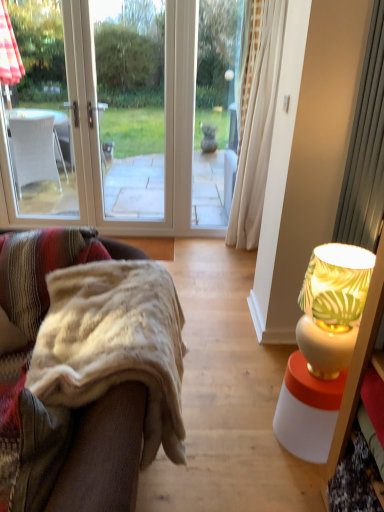
Question: Relative to fuzzy beige blanket at left, is white ceramic lamp at right in front or behind?

Choices:
 (A) front
 (B) behind

Answer: (B)

Question: In the image, is white ceramic lamp at right on the left side or the right side of fuzzy beige blanket at left?

Choices:
 (A) right
 (B) left

Answer: (A)

Question: Is white ceramic lamp at right inside the boundaries of fuzzy beige blanket at left, or outside?

Choices:
 (A) outside
 (B) inside

Answer: (A)

Question: From a real-world perspective, is fuzzy beige blanket at left above or below white ceramic lamp at right?

Choices:
 (A) below
 (B) above

Answer: (A)

Question: Relative to white ceramic lamp at right, is fuzzy beige blanket at left in front or behind?

Choices:
 (A) behind
 (B) front

Answer: (B)

Question: Based on their positions, is fuzzy beige blanket at left located to the left or right of white ceramic lamp at right?

Choices:
 (A) left
 (B) right

Answer: (A)

Question: In terms of width, does fuzzy beige blanket at left look wider or thinner when compared to white ceramic lamp at right?

Choices:
 (A) thin
 (B) wide

Answer: (B)